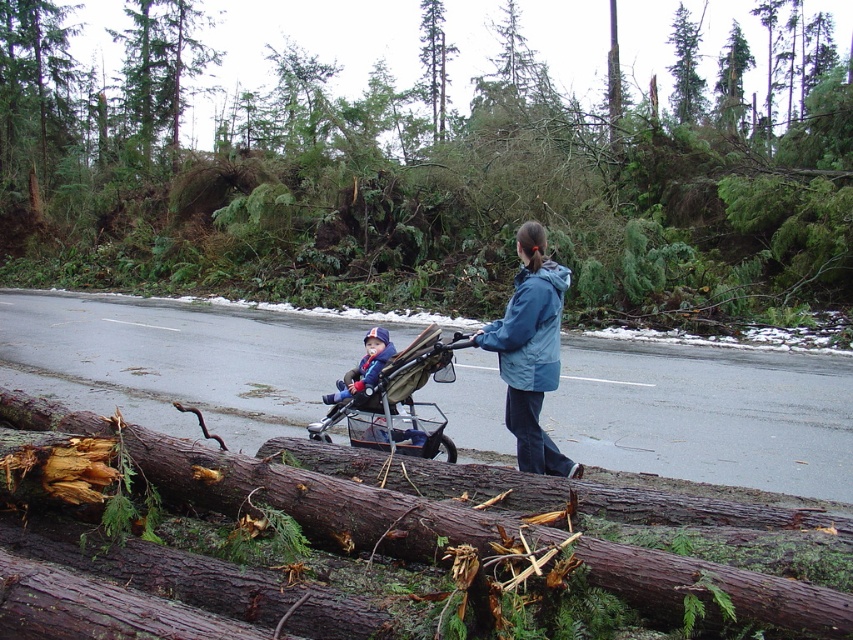
Question: Can you confirm if dark brown wood at center is bigger than blue fabric jacket at center?

Choices:
 (A) yes
 (B) no

Answer: (A)

Question: Considering the relative positions of dark brown wood at center and blue smooth jacket at center in the image provided, where is dark brown wood at center located with respect to blue smooth jacket at center?

Choices:
 (A) above
 (B) below

Answer: (B)

Question: Which is farther from the brown fabric stroller at center?

Choices:
 (A) blue fleece hat at center
 (B) blue fabric jacket at center
 (C) dark brown wood at center

Answer: (C)

Question: Which of these objects is positioned closest to the blue fabric jacket at center?

Choices:
 (A) dark brown wood at center
 (B) brown fabric stroller at center
 (C) blue fleece hat at center
 (D) brown rough log at lower left

Answer: (B)

Question: Among these objects, which one is nearest to the camera?

Choices:
 (A) blue smooth jacket at center
 (B) brown fabric stroller at center
 (C) green textured tree at center
 (D) dark brown wood at center

Answer: (D)

Question: Is dark brown wood at center wider than blue fabric jacket at center?

Choices:
 (A) no
 (B) yes

Answer: (B)